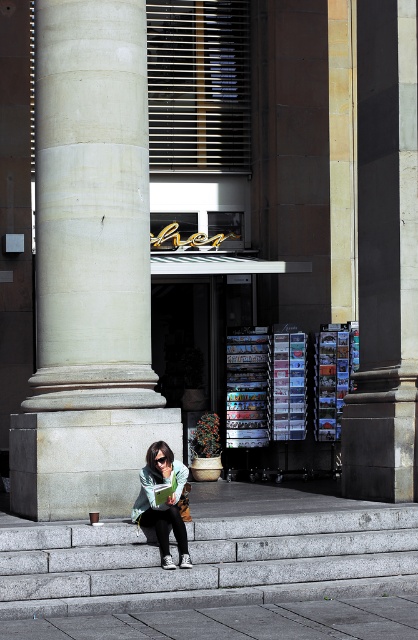
Between point (250, 596) and point (163, 480), which one is positioned behind?

The point (163, 480) is behind.

Does gray concrete stairs at lower left have a lesser height compared to green fabric scarf at lower center?

Yes.

This screenshot has width=418, height=640. Find the location of `gray concrete stairs at lower left`. gray concrete stairs at lower left is located at coordinates (x=208, y=561).

In the scene shown: Does white marble column at center appear under green fabric scarf at lower center?

No.

Is point (73, 115) closer to camera compared to point (145, 525)?

No, (73, 115) is behind (145, 525).

Locate an element on the screen. The width and height of the screenshot is (418, 640). white marble column at center is located at coordinates (91, 209).

Image resolution: width=418 pixels, height=640 pixels. What are the coordinates of `white marble column at center` in the screenshot? It's located at (91, 209).